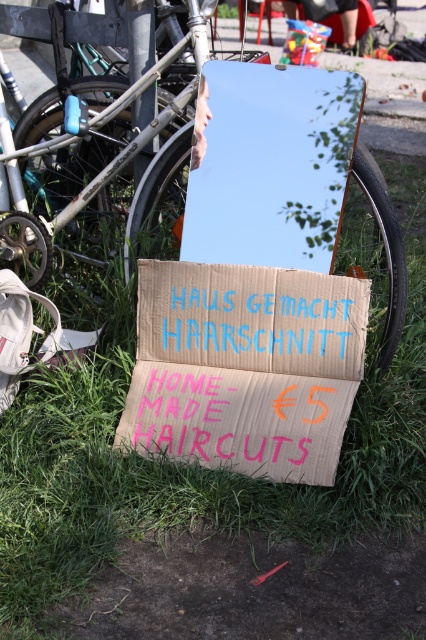
You are setting up a small stand and need to place the cardboard sign at center and the metallic reflective mirror at center next to each other. Which object should you place first if you want the wider item to be on the left side?

The cardboard sign at center is wider than the metallic reflective mirror at center, so you should place the cardboard sign at center first on the left side to have the wider item there.

You are a customer approaching the cardboard sign at center and the metallic reflective mirror at center. Which object will you see first as you walk towards them?

The cardboard sign at center is shorter than the metallic reflective mirror at center, so you will see the metallic reflective mirror at center first because taller objects become visible before shorter ones when approaching from a distance.

You are a customer wanting to get a haircut at the HAUS GEMACHT HAARSCHNITT. You see the silver metallic bicycle at upper left and the cardboard sign at center. How far apart are these two objects?

The silver metallic bicycle at upper left and the cardboard sign at center are 47.34 centimeters apart from each other.